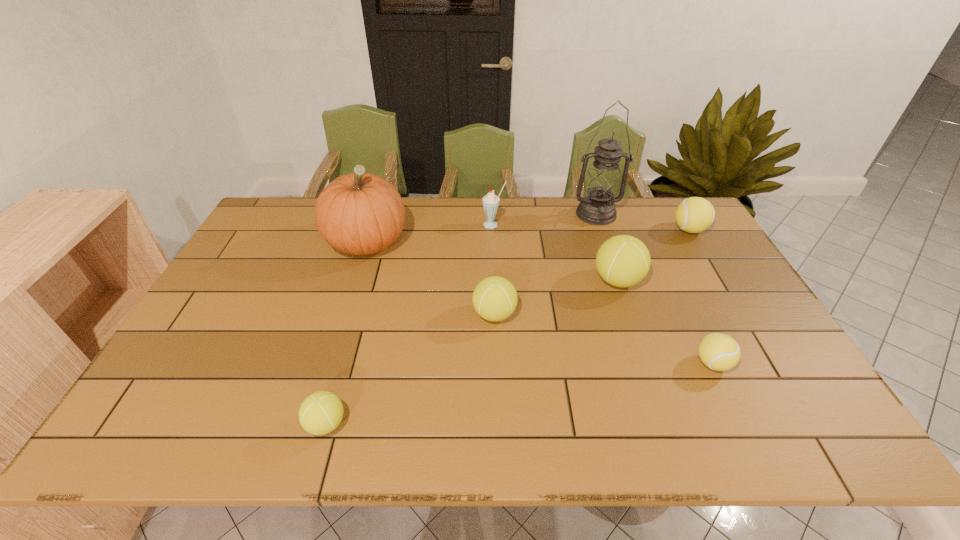
You are a GUI agent. You are given a task and a screenshot of the screen. Output one action in this format:
    pyautogui.click(x=<x>, y=<y>)
    Task: Click on the vacant region between the fourth farthest tennis ball and the rightmost object
    
    Given the screenshot: What is the action you would take?
    pyautogui.click(x=701, y=296)

You are a GUI agent. You are given a task and a screenshot of the screen. Output one action in this format:
    pyautogui.click(x=<x>, y=<y>)
    Task: Click on the vacant area between the rightmost tennis ball and the nearest tennis ball
    This screenshot has width=960, height=540.
    Given the screenshot: What is the action you would take?
    pyautogui.click(x=508, y=327)

The image size is (960, 540). Find the location of `free space between the seventh farthest object and the smallest green tennis ball`. free space between the seventh farthest object and the smallest green tennis ball is located at coordinates (519, 394).

Identify the location of free area in between the farther yellow tennis ball and the third nearest object. (591, 272).

Locate an element on the screen. The height and width of the screenshot is (540, 960). object that stands as the fourth closest to the rightmost object is located at coordinates (490, 201).

Image resolution: width=960 pixels, height=540 pixels. I want to click on object that is the sixth nearest to the oil lamp, so click(360, 213).

Find the location of a particular element. tennis ball that is the second closest to the third tennis ball from left to right is located at coordinates (695, 214).

Where is `tennis ball that can be found as the fourth closest to the biggest green tennis ball`? tennis ball that can be found as the fourth closest to the biggest green tennis ball is located at coordinates (320, 413).

The image size is (960, 540). I want to click on green tennis ball object that ranks as the second closest to the gray oil lamp, so click(494, 298).

Locate an element on the screen. The image size is (960, 540). green tennis ball that is the third closest to the oil lamp is located at coordinates coord(320,413).